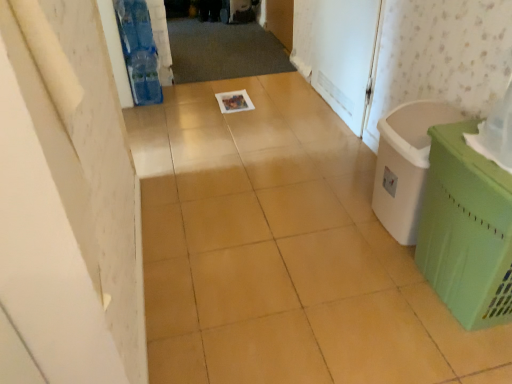
Question: From a real-world perspective, is green plastic laundry basket at right below green plastic basket at right?

Choices:
 (A) no
 (B) yes

Answer: (B)

Question: From the image's perspective, is green plastic laundry basket at right beneath green plastic basket at right?

Choices:
 (A) yes
 (B) no

Answer: (B)

Question: From a real-world perspective, is green plastic laundry basket at right positioned over green plastic basket at right based on gravity?

Choices:
 (A) yes
 (B) no

Answer: (B)

Question: Can you confirm if green plastic laundry basket at right is smaller than green plastic basket at right?

Choices:
 (A) yes
 (B) no

Answer: (A)

Question: Considering the relative sizes of green plastic laundry basket at right and green plastic basket at right in the image provided, is green plastic laundry basket at right thinner than green plastic basket at right?

Choices:
 (A) yes
 (B) no

Answer: (A)

Question: From the image's perspective, is white matte screen door at upper right positioned above or below green plastic laundry basket at right?

Choices:
 (A) above
 (B) below

Answer: (A)

Question: Considering the positions of white matte screen door at upper right and green plastic laundry basket at right in the image, is white matte screen door at upper right taller or shorter than green plastic laundry basket at right?

Choices:
 (A) short
 (B) tall

Answer: (B)

Question: Considering the positions of point [x=328, y=36] and point [x=462, y=119], is point [x=328, y=36] closer or farther from the camera than point [x=462, y=119]?

Choices:
 (A) farther
 (B) closer

Answer: (A)

Question: Is white matte screen door at upper right to the left or to the right of green plastic laundry basket at right in the image?

Choices:
 (A) left
 (B) right

Answer: (A)

Question: In terms of height, does green plastic laundry basket at right look taller or shorter compared to green plastic basket at right?

Choices:
 (A) tall
 (B) short

Answer: (B)

Question: Which is correct: green plastic laundry basket at right is inside green plastic basket at right, or outside of it?

Choices:
 (A) outside
 (B) inside

Answer: (A)

Question: Looking at their shapes, would you say green plastic laundry basket at right is wider or thinner than green plastic basket at right?

Choices:
 (A) thin
 (B) wide

Answer: (A)

Question: From the image's perspective, is green plastic laundry basket at right located above or below green plastic basket at right?

Choices:
 (A) below
 (B) above

Answer: (B)

Question: In terms of height, does green plastic basket at right look taller or shorter compared to green plastic laundry basket at right?

Choices:
 (A) short
 (B) tall

Answer: (B)

Question: From a real-world perspective, is green plastic basket at right positioned above or below green plastic laundry basket at right?

Choices:
 (A) below
 (B) above

Answer: (B)